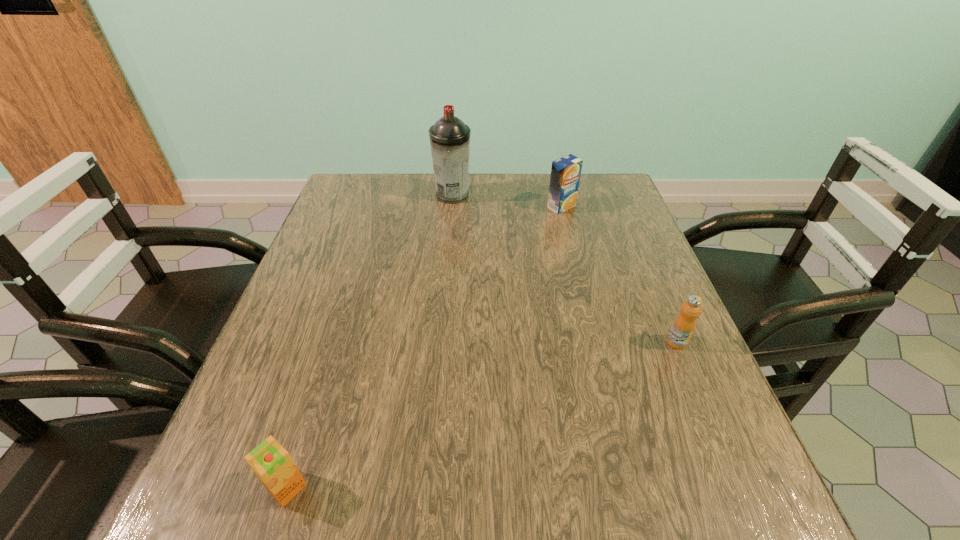
The width and height of the screenshot is (960, 540). Identify the location of empty space between the nearest orange juice and the second orange juice from right to left. (424, 347).

The image size is (960, 540). I want to click on free space between the third object from left to right and the rightmost object, so click(619, 274).

This screenshot has height=540, width=960. I want to click on empty space between the nearest orange juice and the second farthest orange juice, so click(482, 415).

Locate an element on the screen. Image resolution: width=960 pixels, height=540 pixels. object that is the closest one to the third shortest object is located at coordinates (449, 137).

At what (x,y) coordinates should I click in order to perform the action: click on the second closest object to the leftmost orange juice. Please return your answer as a coordinate pair (x, y). Looking at the image, I should click on (449, 137).

Select which orange juice is the second closest to the third farthest object. Please provide its 2D coordinates. Your answer should be formatted as a tuple, i.e. [(x, y)], where the tuple contains the x and y coordinates of a point satisfying the conditions above.

[(270, 461)]

Point out which orange juice is positioned as the second nearest to the third object from right to left. Please provide its 2D coordinates. Your answer should be formatted as a tuple, i.e. [(x, y)], where the tuple contains the x and y coordinates of a point satisfying the conditions above.

[(684, 325)]